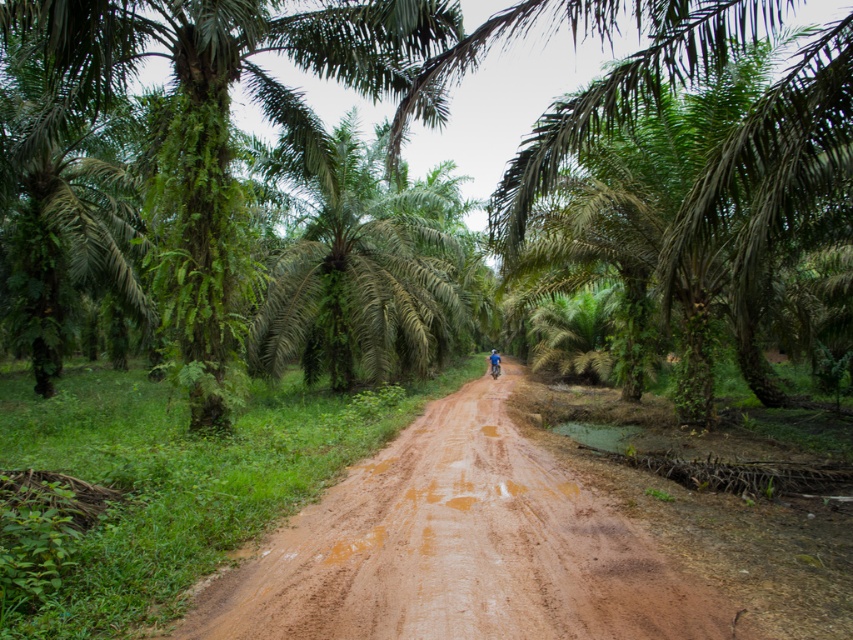
You are a traveler walking along the dirt road in the palm tree plantation. You see the green leafy palm tree at left and the blue fabric helmet at center. Which object is higher from the ground?

The green leafy palm tree at left is located above the blue fabric helmet at center, so the palm tree is higher from the ground.

You are a hiker walking along the dirt road and see the green leafy palm tree at left and the blue fabric helmet at center. Which object is nearer to you?

The green leafy palm tree at left is closer to the viewer than the blue fabric helmet at center, so the palm tree is nearer to you.